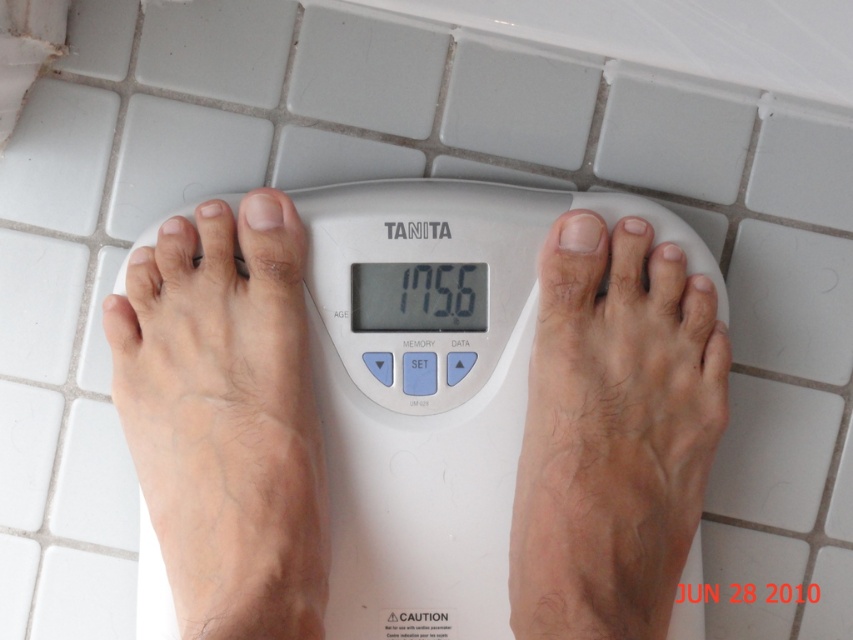
This screenshot has height=640, width=853. What do you see at coordinates (432, 387) in the screenshot?
I see `white plastic scale at center` at bounding box center [432, 387].

Identify the location of white plastic scale at center. This screenshot has height=640, width=853. (432, 387).

This screenshot has width=853, height=640. What do you see at coordinates (432, 387) in the screenshot?
I see `white plastic scale at center` at bounding box center [432, 387].

Find the location of `white plastic scale at center`. white plastic scale at center is located at coordinates (432, 387).

Does pale skin at center appear under light skin textured foot at center?

No, pale skin at center is not below light skin textured foot at center.

Is pale skin at center positioned before light skin textured foot at center?

Yes, it is.

Where is `pale skin at center`? This screenshot has width=853, height=640. pale skin at center is located at coordinates point(225,419).

Is the position of white plastic scale at center less distant than that of pale skin at center?

No, it is not.

Who is higher up, white plastic scale at center or pale skin at center?

white plastic scale at center is higher up.

Is point (354, 564) positioned in front of point (148, 474)?

That is False.

Locate an element on the screen. The height and width of the screenshot is (640, 853). white plastic scale at center is located at coordinates (432, 387).